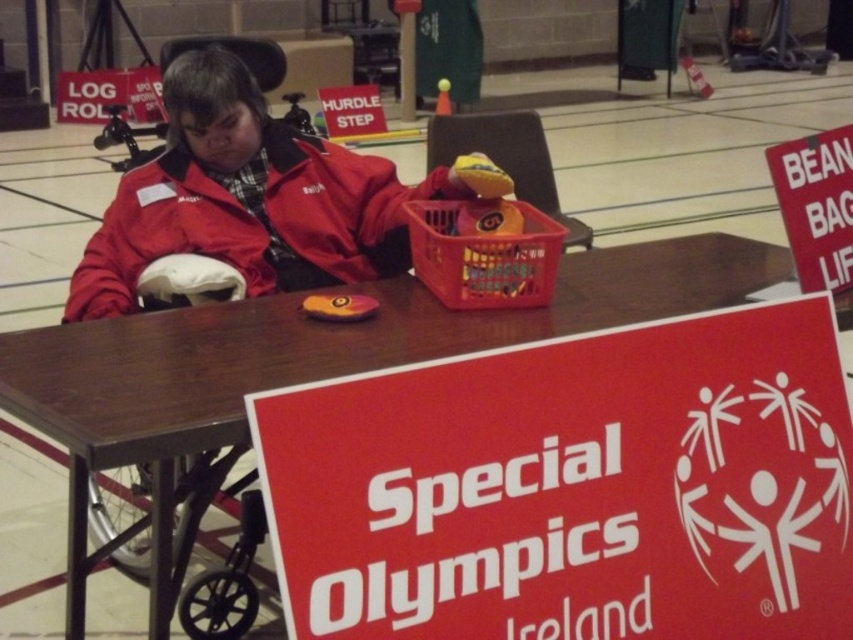
Looking at this image, you are standing in a gymnasium and want to place a 4.5 feet long banner on the floor between you and the brown wooden table at center. Can you fit it there?

The distance between you and the brown wooden table at center is 4.69 feet. Since the banner is 4.5 feet long, it will fit with a small amount of space remaining.

You are organizing an event and need to place a new sign between the brown wooden table at center and the plastic basket at center. According to the scene description, which object should the sign be placed closer to?

The brown wooden table at center is to the right of the plastic basket at center, so the sign should be placed closer to the plastic basket at center to be between them.

What are the coordinates of the brown wooden table at center?

The brown wooden table at center is located at point (311, 360).